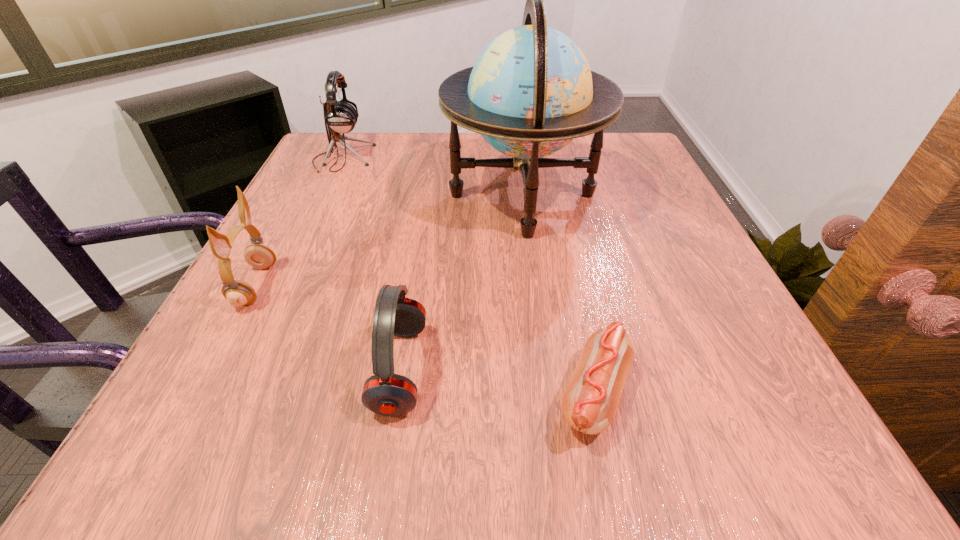
You are a GUI agent. You are given a task and a screenshot of the screen. Output one action in this format:
    pyautogui.click(x=<x>, y=<y>)
    Task: Click on the object at the far left corner
    This screenshot has height=540, width=960.
    Given the screenshot: What is the action you would take?
    pyautogui.click(x=340, y=116)

I want to click on object that is at the far right corner, so click(531, 91).

Find the location of a particular element. Image resolution: width=960 pixels, height=540 pixels. free space at the far edge of the desktop is located at coordinates (440, 170).

I want to click on free space at the near edge, so click(391, 442).

Locate an element on the screen. The width and height of the screenshot is (960, 540). free space at the left edge of the desktop is located at coordinates (333, 241).

At what (x,y) coordinates should I click in order to perform the action: click on free space at the right edge of the desktop. Please return your answer as a coordinate pair (x, y). Image resolution: width=960 pixels, height=540 pixels. Looking at the image, I should click on pyautogui.click(x=714, y=345).

Identify the location of blank space at the near left corner of the desktop. The image size is (960, 540). (215, 429).

Where is `vacant point at the far right corner`? Image resolution: width=960 pixels, height=540 pixels. vacant point at the far right corner is located at coordinates (589, 151).

At what (x,y) coordinates should I click in order to perform the action: click on free space at the near right corner of the desktop. Please return your answer as a coordinate pair (x, y). Looking at the image, I should click on (784, 407).

Identify the location of free space that is in between the shortest object and the fourth shortest object. (468, 276).